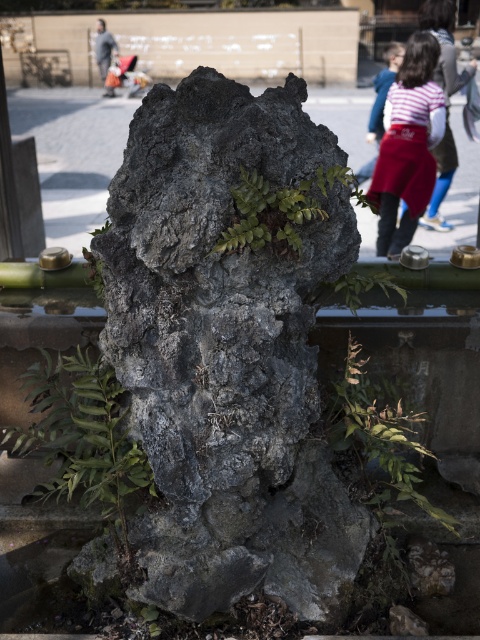
You are standing in a park and see the rough stone rock at center and the striped fabric shirt at upper right. Which object is larger in size?

The rough stone rock at center is smaller than striped fabric shirt at upper right, so the striped fabric shirt at upper right is larger in size.

You are standing near the rock formation and want to hide behind the green leafy plant at center to avoid being seen by someone wearing the gray fabric jacket at upper left. Will the plant be large enough to fully conceal you?

The green leafy plant at center has a larger size compared to gray fabric jacket at upper left, so it is likely large enough to fully conceal you from the jacket wearer.